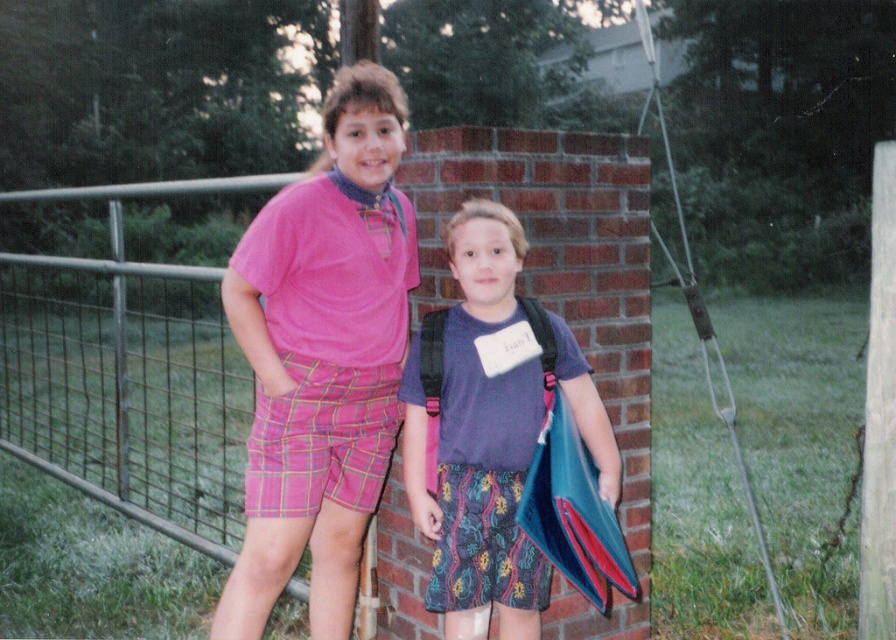
You are a photographer trying to capture a photo of two children wearing shirts. You see the matte pink shirt at center and the matte purple shirt at center. Which child should you move to the left to align both shirts in the center of the frame?

The matte purple shirt at center should be moved to the left to align both shirts in the center of the frame since the matte pink shirt at center is already positioned to its left.

You are a photographer setting up a photo shoot for two children wearing the matte pink shirt at center and the matte purple shirt at center. The fence in the background is at the bottom of the image. To ensure both shirts are visible in the frame, where should you position the camera relative to the fence?

The matte pink shirt at center is located above the matte purple shirt at center. Therefore, to capture both shirts in the frame, the camera should be positioned above the fence to ensure the matte pink shirt at center is visible above the fence and the matte purple shirt at center is visible below the fence.

You are a photographer trying to capture a closeup shot of the matte pink shirt at center and the matte purple shirt at center. Your camera can only focus on objects within 14 inches. Will both shirts be in focus?

The matte pink shirt at center is 15.02 inches away from matte purple shirt at center, which is beyond the camera focus range of 14 inches. Therefore, both shirts cannot be in focus at the same time.